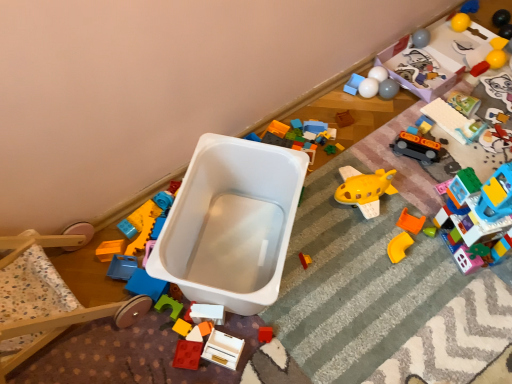
Where is `free space to the back side of orange plastic train at center, the eleventh toy positioned from the left`? The height and width of the screenshot is (384, 512). free space to the back side of orange plastic train at center, the eleventh toy positioned from the left is located at coordinates (415, 125).